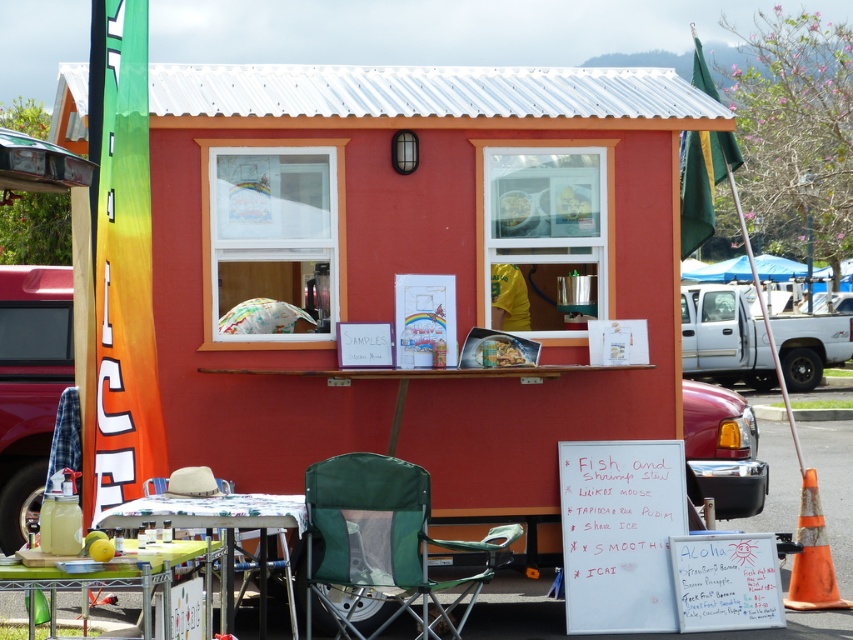
Can you confirm if green fabric folding chair at lower center is shorter than green plastic table at lower left?

In fact, green fabric folding chair at lower center may be taller than green plastic table at lower left.

Between point (396, 499) and point (225, 566), which one is positioned behind?

The point (225, 566) is more distant.

Is point (380, 570) behind point (152, 502)?

Yes, point (380, 570) is farther from viewer.

Find the location of a particular element. The width and height of the screenshot is (853, 640). green fabric folding chair at lower center is located at coordinates (381, 540).

Can you confirm if white plastic truck at center is positioned below translucent plastic bag at upper center?

Indeed, white plastic truck at center is positioned under translucent plastic bag at upper center.

Locate an element on the screen. The height and width of the screenshot is (640, 853). white plastic truck at center is located at coordinates (724, 337).

Is point (782, 349) less distant than point (502, 230)?

No, (782, 349) is further to viewer.

Where is `white plastic truck at center`? This screenshot has height=640, width=853. white plastic truck at center is located at coordinates (724, 337).

Which of these two, green mesh table at center or green plastic table at lower left, stands taller?

green plastic table at lower left is taller.

The height and width of the screenshot is (640, 853). What do you see at coordinates (117, 579) in the screenshot?
I see `green mesh table at center` at bounding box center [117, 579].

This screenshot has height=640, width=853. What are the coordinates of `green mesh table at center` in the screenshot? It's located at (117, 579).